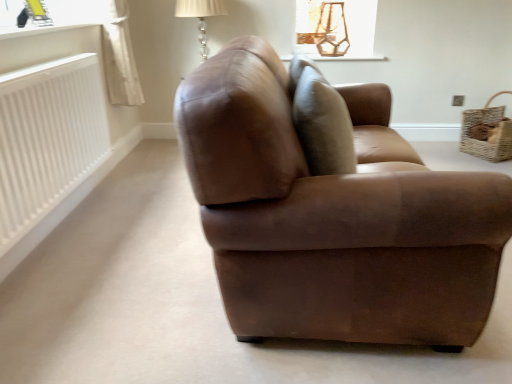
Question: Would you say woven brown basket at right is inside or outside white ribbed radiator at left?

Choices:
 (A) inside
 (B) outside

Answer: (B)

Question: Considering the positions of woven brown basket at right and white ribbed radiator at left in the image, is woven brown basket at right wider or thinner than white ribbed radiator at left?

Choices:
 (A) thin
 (B) wide

Answer: (B)

Question: Estimate the real-world distances between objects in this image. Which object is farther from the brown leather couch at center?

Choices:
 (A) brown leather swivel chair at center
 (B) white ribbed radiator at left
 (C) satin glass table lamp at upper center
 (D) white glossy window sill at upper left, the 1th window sill when ordered from left to right
 (E) woven brown basket at right

Answer: (E)

Question: Estimate the real-world distances between objects in this image. Which object is closer to the white ribbed radiator at left?

Choices:
 (A) white glossy window sill at upper left, the 1th window sill from the front
 (B) brown leather swivel chair at center
 (C) woven brown basket at right
 (D) brown leather couch at center
 (E) matte white wood at upper center, which ranks as the 1th window sill in back-to-front order

Answer: (A)